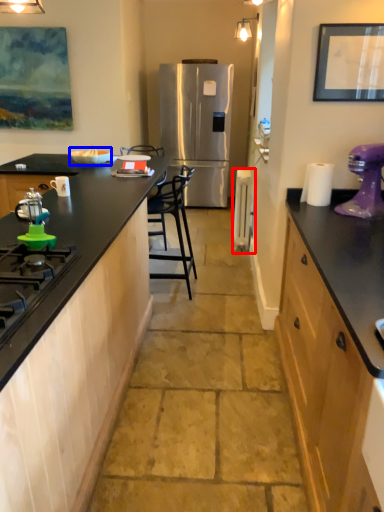
Question: Which of the following is the farthest to the observer, appliance (highlighted by a red box) or appliance (highlighted by a blue box)?

Choices:
 (A) appliance
 (B) appliance

Answer: (A)